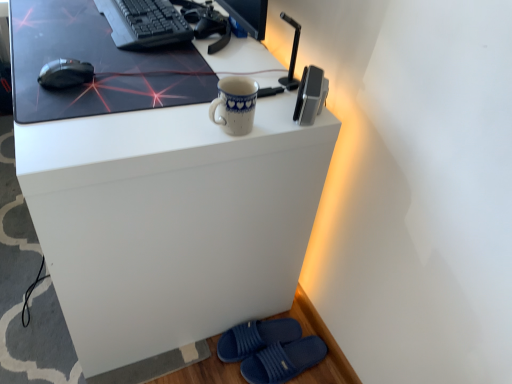
Locate an element on the screen. Image resolution: width=512 pixels, height=384 pixels. free space in front of black matte mouse at left is located at coordinates (58, 112).